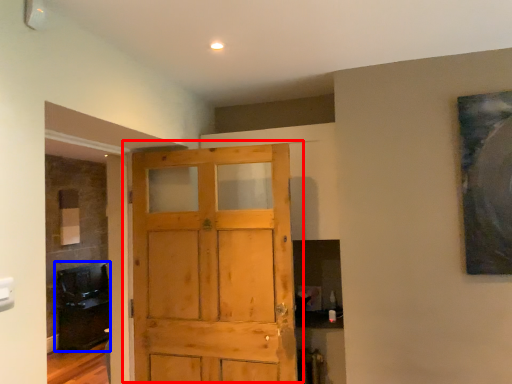
Question: Which of the following is the closest to the observer, door (highlighted by a red box) or cabinetry (highlighted by a blue box)?

Choices:
 (A) door
 (B) cabinetry

Answer: (A)